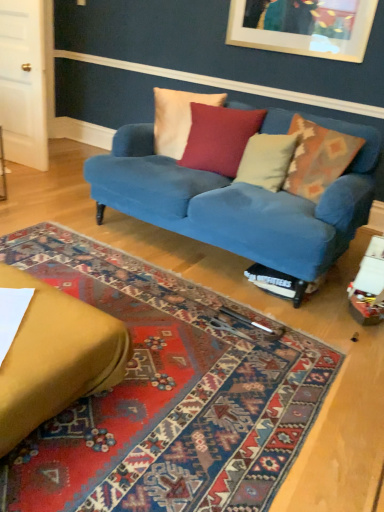
Question: From the image's perspective, would you say carpeted rug at center is shown under velvet yellow studio couch at lower left, which ranks as the second studio couch in back-to-front order?

Choices:
 (A) no
 (B) yes

Answer: (B)

Question: Does carpeted rug at center appear on the right side of velvet yellow studio couch at lower left, which ranks as the second studio couch in back-to-front order?

Choices:
 (A) no
 (B) yes

Answer: (B)

Question: Does carpeted rug at center come in front of velvet yellow studio couch at lower left, which is counted as the first studio couch, starting from the front?

Choices:
 (A) no
 (B) yes

Answer: (B)

Question: Could you tell me if carpeted rug at center is turned towards velvet yellow studio couch at lower left, which is counted as the first studio couch, starting from the front?

Choices:
 (A) yes
 (B) no

Answer: (B)

Question: Considering the relative positions of carpeted rug at center and velvet yellow studio couch at lower left, which is counted as the first studio couch, starting from the front, in the image provided, is carpeted rug at center to the left of velvet yellow studio couch at lower left, which is counted as the first studio couch, starting from the front, from the viewer's perspective?

Choices:
 (A) yes
 (B) no

Answer: (B)

Question: Is carpeted rug at center positioned behind velvet yellow studio couch at lower left, which is counted as the first studio couch, starting from the front?

Choices:
 (A) yes
 (B) no

Answer: (B)

Question: Is velvet blue couch at center, placed as the 1th studio couch when sorted from back to front, oriented towards carpeted rug at center?

Choices:
 (A) yes
 (B) no

Answer: (A)

Question: Can you confirm if velvet blue couch at center, arranged as the 2th studio couch when viewed from the front, is positioned to the left of carpeted rug at center?

Choices:
 (A) no
 (B) yes

Answer: (A)

Question: Does velvet blue couch at center, placed as the 1th studio couch when sorted from back to front, have a lesser height compared to carpeted rug at center?

Choices:
 (A) no
 (B) yes

Answer: (A)

Question: Is velvet blue couch at center, placed as the 1th studio couch when sorted from back to front, in front of carpeted rug at center?

Choices:
 (A) no
 (B) yes

Answer: (A)

Question: Is velvet blue couch at center, arranged as the 2th studio couch when viewed from the front, bigger than carpeted rug at center?

Choices:
 (A) yes
 (B) no

Answer: (A)

Question: Would you say carpeted rug at center is part of velvet blue couch at center, placed as the 1th studio couch when sorted from back to front,'s contents?

Choices:
 (A) no
 (B) yes

Answer: (A)

Question: Can white soft pillow at center, which is counted as the third pillow, starting from the left, be found inside white cotton pillow at center, the first pillow viewed from the left?

Choices:
 (A) no
 (B) yes

Answer: (A)